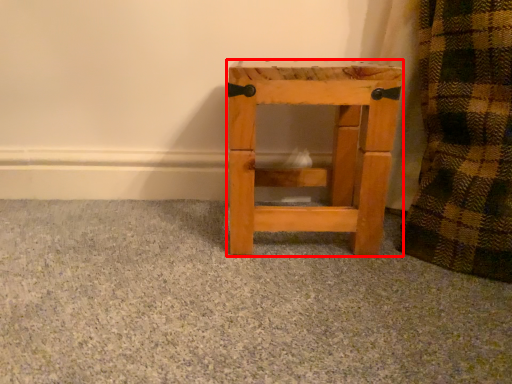
Question: From the image's perspective, what is the correct spatial relationship of furniture (annotated by the red box) in relation to concrete?

Choices:
 (A) above
 (B) below

Answer: (A)